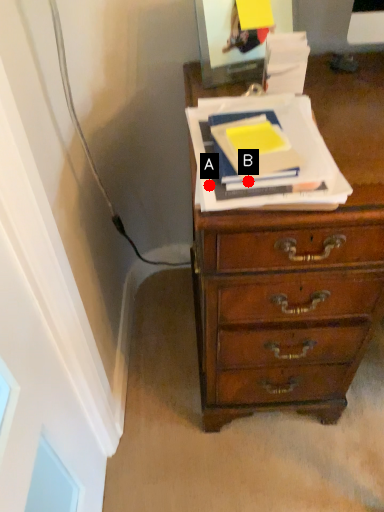
Question: Two points are circled on the image, labeled by A and B beside each circle. Which of the following is the closest to the observer?

Choices:
 (A) A is closer
 (B) B is closer

Answer: (B)